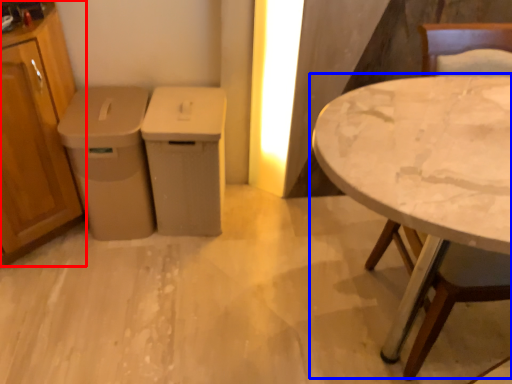
Question: Which object is closer to the camera taking this photo, cabinetry (highlighted by a red box) or table (highlighted by a blue box)?

Choices:
 (A) cabinetry
 (B) table

Answer: (B)